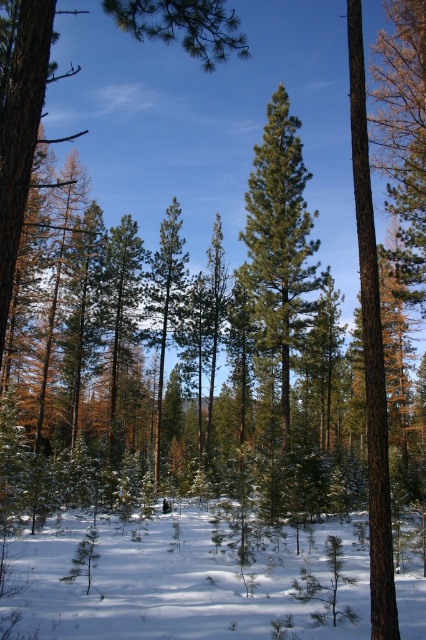
Question: Is white powdery snow at center to the left of green needle-like tree at center from the viewer's perspective?

Choices:
 (A) yes
 (B) no

Answer: (A)

Question: Does white powdery snow at center appear over green needle-like tree at center?

Choices:
 (A) no
 (B) yes

Answer: (A)

Question: Which object appears farthest from the camera in this image?

Choices:
 (A) white powdery snow at center
 (B) green needle-like tree at center

Answer: (B)

Question: Can you confirm if white powdery snow at center is positioned above green needle-like tree at center?

Choices:
 (A) yes
 (B) no

Answer: (B)

Question: Which point is farther from the camera taking this photo?

Choices:
 (A) (66, 570)
 (B) (310, 221)

Answer: (B)